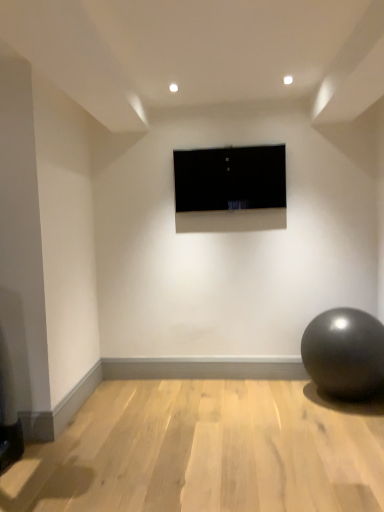
Question: Is black glossy tv at center closer to camera compared to shiny metallic ball at lower right?

Choices:
 (A) no
 (B) yes

Answer: (A)

Question: Is black glossy tv at center facing towards shiny metallic ball at lower right?

Choices:
 (A) yes
 (B) no

Answer: (B)

Question: Is black glossy tv at center thinner than shiny metallic ball at lower right?

Choices:
 (A) yes
 (B) no

Answer: (A)

Question: Is black glossy tv at center shorter than shiny metallic ball at lower right?

Choices:
 (A) no
 (B) yes

Answer: (B)

Question: From a real-world perspective, is black glossy tv at center under shiny metallic ball at lower right?

Choices:
 (A) no
 (B) yes

Answer: (A)

Question: Is black glossy tv at center facing away from shiny metallic ball at lower right?

Choices:
 (A) yes
 (B) no

Answer: (B)

Question: Does shiny metallic ball at lower right come behind black glossy tv at center?

Choices:
 (A) yes
 (B) no

Answer: (B)

Question: Can you confirm if shiny metallic ball at lower right is smaller than black glossy tv at center?

Choices:
 (A) no
 (B) yes

Answer: (A)

Question: Considering the relative sizes of shiny metallic ball at lower right and black glossy tv at center in the image provided, is shiny metallic ball at lower right wider than black glossy tv at center?

Choices:
 (A) yes
 (B) no

Answer: (A)

Question: Does shiny metallic ball at lower right appear on the right side of black glossy tv at center?

Choices:
 (A) no
 (B) yes

Answer: (B)

Question: Is shiny metallic ball at lower right thinner than black glossy tv at center?

Choices:
 (A) no
 (B) yes

Answer: (A)

Question: Is shiny metallic ball at lower right at the left side of black glossy tv at center?

Choices:
 (A) yes
 (B) no

Answer: (B)

Question: Is point click(x=357, y=362) positioned closer to the camera than point click(x=201, y=177)?

Choices:
 (A) farther
 (B) closer

Answer: (B)